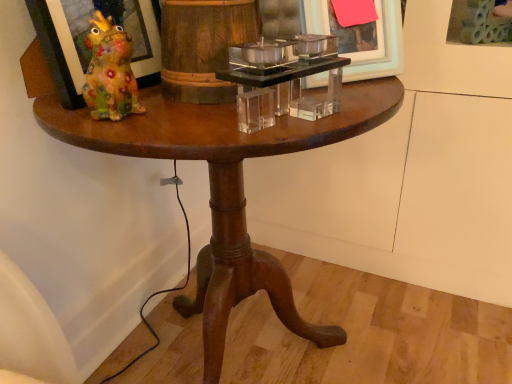
What do you see at coordinates (54, 53) in the screenshot? Image resolution: width=512 pixels, height=384 pixels. I see `matte glass picture frame at left, which is the first picture frame in left-to-right order` at bounding box center [54, 53].

In order to face matte glass picture frame at left, which is the first picture frame in left-to-right order, should I rotate leftwards or rightwards?

Turn left approximately 19.874 degrees to face it.

Where is `wooden pedestal table at center`? This screenshot has width=512, height=384. wooden pedestal table at center is located at coordinates (224, 187).

The width and height of the screenshot is (512, 384). What do you see at coordinates (283, 79) in the screenshot?
I see `clear acrylic candle holder at center` at bounding box center [283, 79].

At what (x,y) coordinates should I click in order to perform the action: click on matte glass picture frame at left, which appears as the third picture frame when viewed from the right. Please return your answer as a coordinate pair (x, y). Looking at the image, I should click on (54, 53).

Could you tell me if matte glass picture frame at left, which appears as the third picture frame when viewed from the right, is turned towards clear acrylic picture frame at upper right, the first picture frame when ordered from right to left?

No, matte glass picture frame at left, which appears as the third picture frame when viewed from the right, is not facing towards clear acrylic picture frame at upper right, the first picture frame when ordered from right to left.

From a real-world perspective, is matte glass picture frame at left, which is the first picture frame in left-to-right order, below clear acrylic picture frame at upper right, the first picture frame when ordered from right to left?

No, from a real-world perspective, matte glass picture frame at left, which is the first picture frame in left-to-right order, is not below clear acrylic picture frame at upper right, the first picture frame when ordered from right to left.

How far apart are matte glass picture frame at left, which is the first picture frame in left-to-right order, and clear acrylic picture frame at upper right, the first picture frame when ordered from right to left?

matte glass picture frame at left, which is the first picture frame in left-to-right order, is 78.92 centimeters away from clear acrylic picture frame at upper right, the first picture frame when ordered from right to left.

Do you think matte glass picture frame at left, which is the first picture frame in left-to-right order, is within clear acrylic picture frame at upper right, which ranks as the third picture frame in left-to-right order, or outside of it?

matte glass picture frame at left, which is the first picture frame in left-to-right order, is not inside clear acrylic picture frame at upper right, which ranks as the third picture frame in left-to-right order, it's outside.

Considering the positions of point (376, 10) and point (481, 31), is point (376, 10) closer or farther from the camera than point (481, 31)?

Point (376, 10).

From the image's perspective, does matte white picture frame at upper center, which ranks as the second picture frame in left-to-right order, appear lower than clear acrylic picture frame at upper right, which ranks as the third picture frame in left-to-right order?

Yes, from the image's perspective, matte white picture frame at upper center, which ranks as the second picture frame in left-to-right order, is below clear acrylic picture frame at upper right, which ranks as the third picture frame in left-to-right order.

Is matte white picture frame at upper center, marked as the 2th picture frame in a right-to-left arrangement, in front of or behind clear acrylic picture frame at upper right, the first picture frame when ordered from right to left, in the image?

In the image, matte white picture frame at upper center, marked as the 2th picture frame in a right-to-left arrangement, appears in front of clear acrylic picture frame at upper right, the first picture frame when ordered from right to left.

Which is more to the right, matte white picture frame at upper center, which ranks as the second picture frame in left-to-right order, or clear acrylic picture frame at upper right, the first picture frame when ordered from right to left?

clear acrylic picture frame at upper right, the first picture frame when ordered from right to left.

Considering the sizes of objects clear acrylic candle holder at center and matte glass picture frame at left, which is the first picture frame in left-to-right order, in the image provided, who is taller, clear acrylic candle holder at center or matte glass picture frame at left, which is the first picture frame in left-to-right order,?

matte glass picture frame at left, which is the first picture frame in left-to-right order.

Does clear acrylic candle holder at center lie behind matte glass picture frame at left, which appears as the third picture frame when viewed from the right?

No, clear acrylic candle holder at center is closer to the viewer.

From a real-world perspective, between clear acrylic candle holder at center and matte glass picture frame at left, which appears as the third picture frame when viewed from the right, who is vertically higher?

matte glass picture frame at left, which appears as the third picture frame when viewed from the right.

Can you confirm if clear acrylic candle holder at center is positioned to the left of matte glass picture frame at left, which is the first picture frame in left-to-right order?

Result: No, clear acrylic candle holder at center is not to the left of matte glass picture frame at left, which is the first picture frame in left-to-right order.

Could you tell me if clear acrylic candle holder at center is facing clear acrylic picture frame at upper right, which ranks as the third picture frame in left-to-right order?

No, clear acrylic candle holder at center is not turned towards clear acrylic picture frame at upper right, which ranks as the third picture frame in left-to-right order.

Considering the points (243, 115) and (451, 13), which point is in front, point (243, 115) or point (451, 13)?

The point (243, 115) is closer to the camera.

Could clear acrylic picture frame at upper right, which ranks as the third picture frame in left-to-right order, be considered to be inside clear acrylic candle holder at center?

No.

From the picture: Which object is positioned more to the right, clear acrylic candle holder at center or clear acrylic picture frame at upper right, which ranks as the third picture frame in left-to-right order?

clear acrylic picture frame at upper right, which ranks as the third picture frame in left-to-right order, is more to the right.

Which object is more forward, matte white picture frame at upper center, marked as the 2th picture frame in a right-to-left arrangement, or matte glass picture frame at left, which is the first picture frame in left-to-right order?

matte glass picture frame at left, which is the first picture frame in left-to-right order.

Between matte white picture frame at upper center, which ranks as the second picture frame in left-to-right order, and matte glass picture frame at left, which is the first picture frame in left-to-right order, which one has more height?

matte glass picture frame at left, which is the first picture frame in left-to-right order.

Is point (324, 14) behind point (73, 7)?

Yes, point (324, 14) is farther from viewer.

Who is smaller, matte white picture frame at upper center, marked as the 2th picture frame in a right-to-left arrangement, or matte glass picture frame at left, which appears as the third picture frame when viewed from the right?

matte white picture frame at upper center, marked as the 2th picture frame in a right-to-left arrangement.

At what (x,y) coordinates should I click in order to perform the action: click on coffee table in front of the matte white picture frame at upper center, marked as the 2th picture frame in a right-to-left arrangement. Please return your answer as a coordinate pair (x, y). The image size is (512, 384). Looking at the image, I should click on (224, 187).

Between wooden pedestal table at center and matte white picture frame at upper center, which ranks as the second picture frame in left-to-right order, which one appears on the left side from the viewer's perspective?

wooden pedestal table at center.

From the image's perspective, is wooden pedestal table at center located above matte white picture frame at upper center, which ranks as the second picture frame in left-to-right order?

No, from the image's perspective, wooden pedestal table at center is not over matte white picture frame at upper center, which ranks as the second picture frame in left-to-right order.

Which is more distant, (172,125) or (359,72)?

The point (359,72) is farther from the camera.

Which is more to the left, clear acrylic picture frame at upper right, the first picture frame when ordered from right to left, or wooden pedestal table at center?

Positioned to the left is wooden pedestal table at center.

Is clear acrylic picture frame at upper right, which ranks as the third picture frame in left-to-right order, far away from wooden pedestal table at center?

They are positioned close to each other.

Is point (454, 24) positioned before point (350, 90)?

No, (454, 24) is behind (350, 90).

Is clear acrylic picture frame at upper right, the first picture frame when ordered from right to left, positioned with its back to wooden pedestal table at center?

No, wooden pedestal table at center is not at the back of clear acrylic picture frame at upper right, the first picture frame when ordered from right to left.

The image size is (512, 384). I want to click on the 2nd picture frame counting from the left of the clear acrylic picture frame at upper right, the first picture frame when ordered from right to left, so click(54, 53).

Find the location of a particular element. The height and width of the screenshot is (384, 512). picture frame behind the matte white picture frame at upper center, marked as the 2th picture frame in a right-to-left arrangement is located at coordinates (480, 22).

Looking at this image, from the image, which object appears to be nearer to matte white picture frame at upper center, marked as the 2th picture frame in a right-to-left arrangement, wooden pedestal table at center or clear acrylic picture frame at upper right, which ranks as the third picture frame in left-to-right order?

wooden pedestal table at center.

Based on their spatial positions, is matte glass picture frame at left, which appears as the third picture frame when viewed from the right, or wooden pedestal table at center closer to clear acrylic candle holder at center?

Based on the image, wooden pedestal table at center appears to be nearer to clear acrylic candle holder at center.

Based on their spatial positions, is clear acrylic picture frame at upper right, the first picture frame when ordered from right to left, or matte glass picture frame at left, which is the first picture frame in left-to-right order, further from wooden pedestal table at center?

clear acrylic picture frame at upper right, the first picture frame when ordered from right to left.

When comparing their distances from clear acrylic picture frame at upper right, which ranks as the third picture frame in left-to-right order, does matte glass picture frame at left, which is the first picture frame in left-to-right order, or clear acrylic candle holder at center seem further?

matte glass picture frame at left, which is the first picture frame in left-to-right order, lies further to clear acrylic picture frame at upper right, which ranks as the third picture frame in left-to-right order, than the other object.

Estimate the real-world distances between objects in this image. Which object is closer to wooden pedestal table at center, matte glass picture frame at left, which appears as the third picture frame when viewed from the right, or clear acrylic picture frame at upper right, the first picture frame when ordered from right to left?

matte glass picture frame at left, which appears as the third picture frame when viewed from the right, lies closer to wooden pedestal table at center than the other object.

Considering their positions, is matte white picture frame at upper center, marked as the 2th picture frame in a right-to-left arrangement, positioned further to clear acrylic candle holder at center than matte glass picture frame at left, which appears as the third picture frame when viewed from the right?

matte glass picture frame at left, which appears as the third picture frame when viewed from the right, is positioned further to the anchor clear acrylic candle holder at center.

From the image, which object appears to be farther from matte glass picture frame at left, which is the first picture frame in left-to-right order, wooden pedestal table at center or matte white picture frame at upper center, marked as the 2th picture frame in a right-to-left arrangement?

The object further to matte glass picture frame at left, which is the first picture frame in left-to-right order, is matte white picture frame at upper center, marked as the 2th picture frame in a right-to-left arrangement.

Estimate the real-world distances between objects in this image. Which object is closer to matte glass picture frame at left, which is the first picture frame in left-to-right order, clear acrylic picture frame at upper right, the first picture frame when ordered from right to left, or clear acrylic candle holder at center?

Based on the image, clear acrylic candle holder at center appears to be nearer to matte glass picture frame at left, which is the first picture frame in left-to-right order.

Find the location of a particular element. Image resolution: width=512 pixels, height=384 pixels. candle holder between matte glass picture frame at left, which appears as the third picture frame when viewed from the right, and clear acrylic picture frame at upper right, which ranks as the third picture frame in left-to-right order, from left to right is located at coordinates (283, 79).

The image size is (512, 384). What are the coordinates of `candle holder between matte white picture frame at upper center, which ranks as the second picture frame in left-to-right order, and wooden pedestal table at center in the up-down direction` in the screenshot? It's located at (283, 79).

At what (x,y) coordinates should I click in order to perform the action: click on candle holder between wooden pedestal table at center and clear acrylic picture frame at upper right, the first picture frame when ordered from right to left, from left to right. Please return your answer as a coordinate pair (x, y). This screenshot has width=512, height=384. Looking at the image, I should click on (283, 79).

This screenshot has height=384, width=512. Identify the location of coffee table between matte glass picture frame at left, which is the first picture frame in left-to-right order, and clear acrylic picture frame at upper right, which ranks as the third picture frame in left-to-right order. (224, 187).